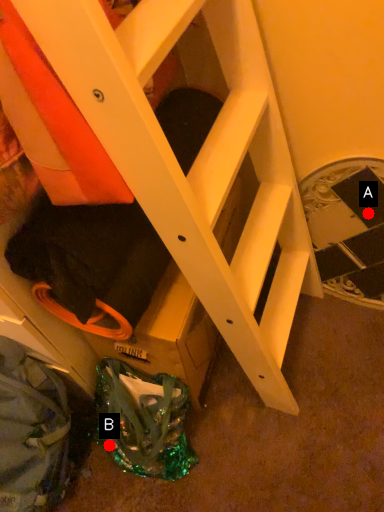
Question: Two points are circled on the image, labeled by A and B beside each circle. Among these points, which one is nearest to the camera?

Choices:
 (A) A is closer
 (B) B is closer

Answer: (A)